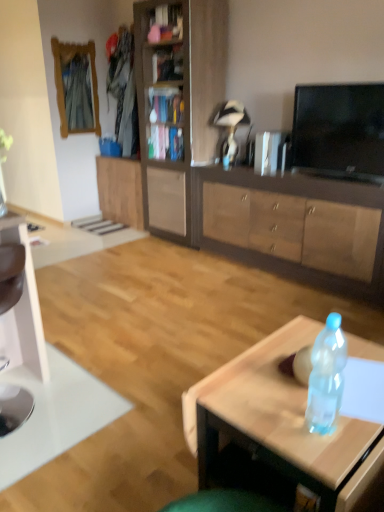
Question: Is wooden cabinet at center, which is counted as the second cabinetry, starting from the left, spatially inside translucent plastic bottle at center, or outside of it?

Choices:
 (A) inside
 (B) outside

Answer: (B)

Question: Considering their positions, is wooden cabinet at center, which is the 2th cabinetry in right-to-left order, located in front of or behind translucent plastic bottle at center?

Choices:
 (A) behind
 (B) front

Answer: (A)

Question: Estimate the real-world distances between objects in this image. Which object is closer to the wooden bookshelf at center?

Choices:
 (A) wooden frame mirror at upper left
 (B) wooden cabinet at center, which is the 2th cabinetry in right-to-left order
 (C) brown wood cabinet at center, positioned as the first cabinetry in right-to-left order
 (D) translucent plastic bottle at center
 (E) wooden bookshelf at upper center

Answer: (B)

Question: Which object is the farthest from the wooden cabinet at center, marked as the 1th cabinetry in a left-to-right arrangement?

Choices:
 (A) wooden frame mirror at upper left
 (B) metallic silver tv at upper right
 (C) translucent plastic bottle at center
 (D) wooden bookshelf at center
 (E) white glossy computer desk at left

Answer: (C)